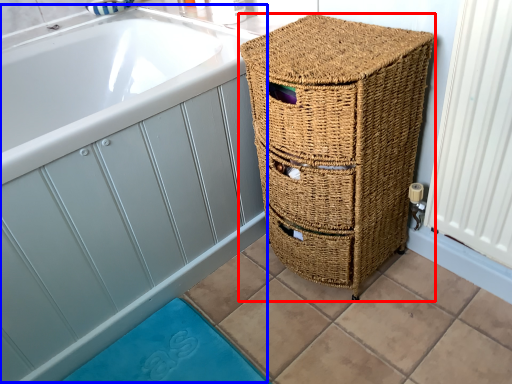
Question: Which point is closer to the camera, furniture (highlighted by a red box) or bath (highlighted by a blue box)?

Choices:
 (A) furniture
 (B) bath

Answer: (B)